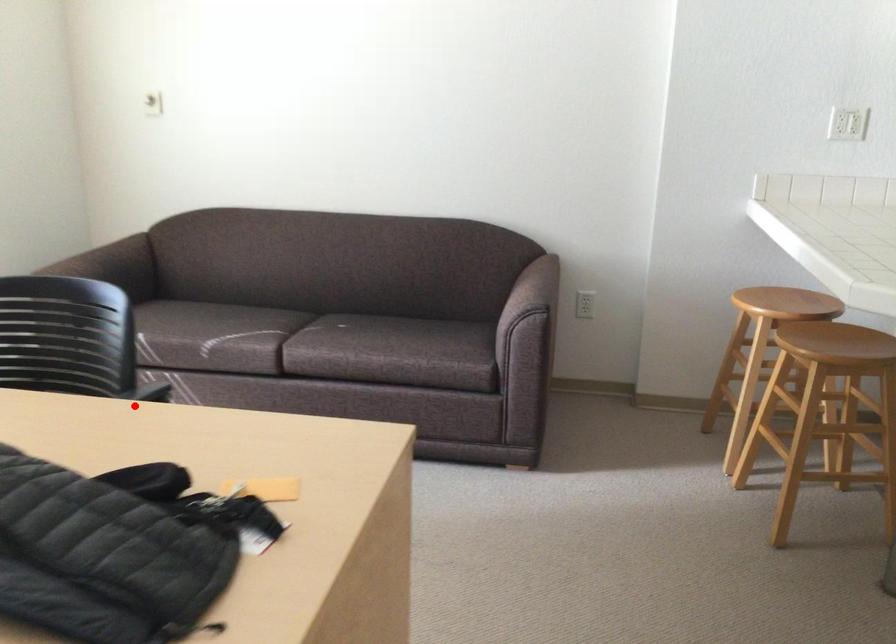
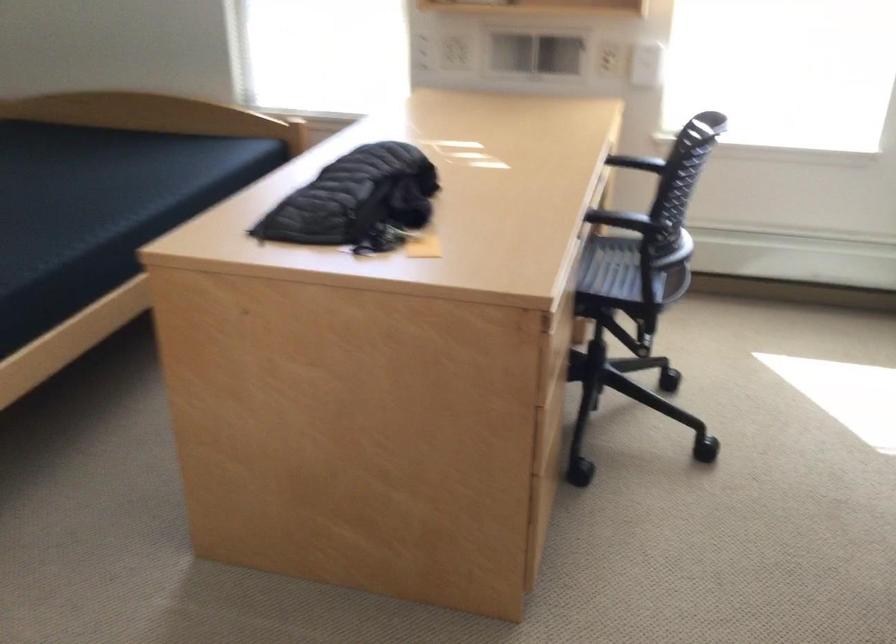
Question: I am providing you with two images of the same scene from different viewpoints. Given a red point in image1, look at the same physical point in image2. Is it:

Choices:
 (A) Closer to the viewpoint
 (B) Farther from the viewpoint

Answer: (B)